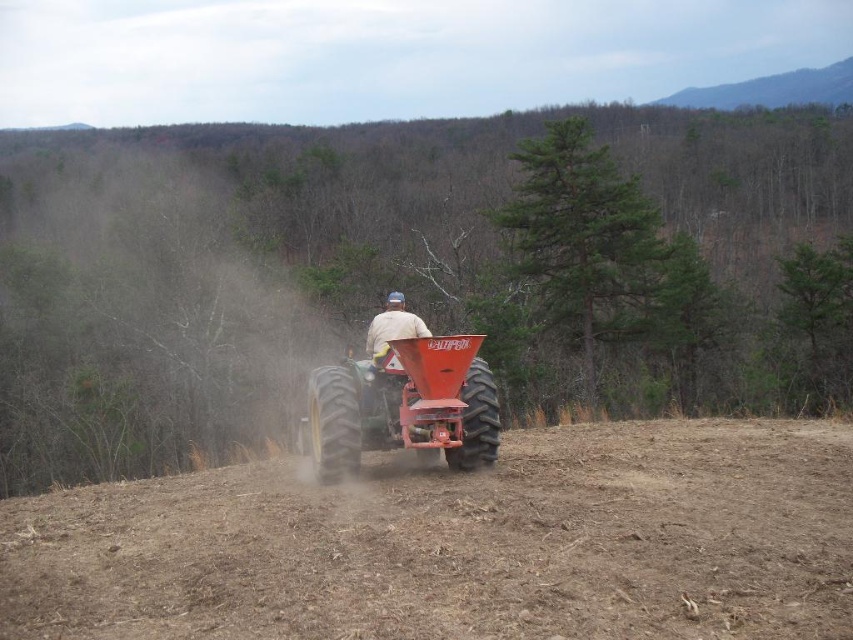
Who is more forward, (372, 612) or (437, 340)?

Positioned in front is point (372, 612).

Is brown soil at center closer to the viewer compared to green rubber tractor at center?

Yes, brown soil at center is closer to the viewer.

Is point (579, 604) positioned after point (454, 435)?

No.

Locate an element on the screen. This screenshot has height=640, width=853. brown soil at center is located at coordinates point(459,545).

In the scene shown: Can you confirm if green rubber tractor at center is bigger than white matte shirt at center?

Correct, green rubber tractor at center is larger in size than white matte shirt at center.

Does green rubber tractor at center have a greater height compared to white matte shirt at center?

Yes.

Is point (433, 372) behind point (381, 314)?

That is False.

Find the location of `green rubber tractor at center`. green rubber tractor at center is located at coordinates (403, 406).

Which is more to the right, brown soil at center or white matte shirt at center?

From the viewer's perspective, brown soil at center appears more on the right side.

This screenshot has width=853, height=640. What do you see at coordinates (459, 545) in the screenshot?
I see `brown soil at center` at bounding box center [459, 545].

Who is more forward, (625, 573) or (392, 323)?

Point (625, 573) is more forward.

Where is `brown soil at center`? This screenshot has height=640, width=853. brown soil at center is located at coordinates pyautogui.click(x=459, y=545).